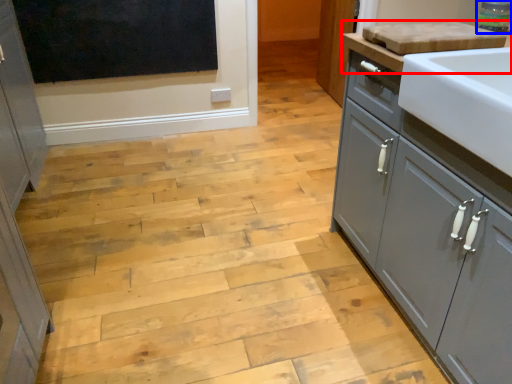
Question: Which of the following is the farthest to the observer, countertop (highlighted by a red box) or appliance (highlighted by a blue box)?

Choices:
 (A) countertop
 (B) appliance

Answer: (B)